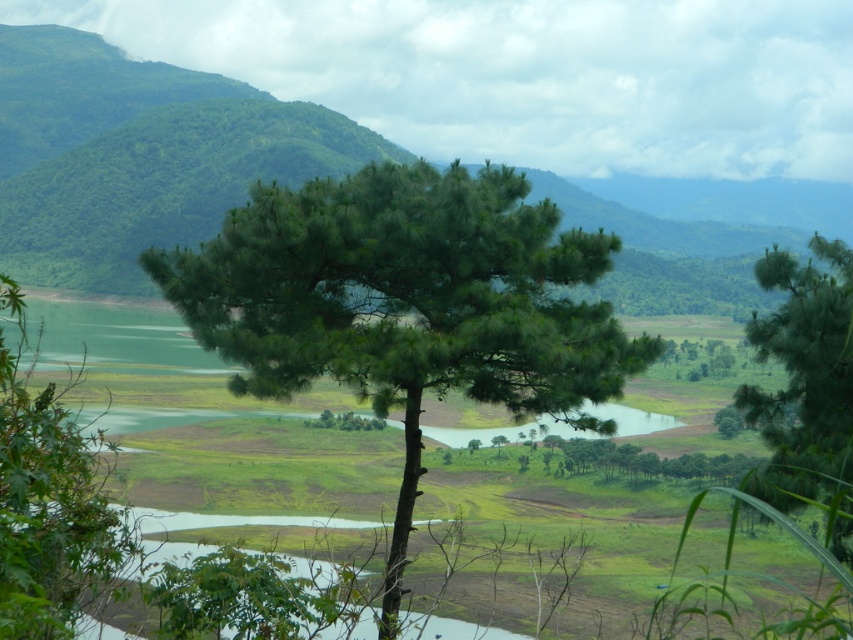
The image size is (853, 640). Describe the element at coordinates (405, 304) in the screenshot. I see `green matte tree at center` at that location.

Based on the photo, how distant is green matte tree at center from green matte tree at lower left?

They are 14.05 meters apart.

The height and width of the screenshot is (640, 853). In order to click on green matte tree at center in this screenshot , I will do `click(405, 304)`.

Image resolution: width=853 pixels, height=640 pixels. What do you see at coordinates (405, 304) in the screenshot? I see `green matte tree at center` at bounding box center [405, 304].

Where is `green matte tree at center`? This screenshot has height=640, width=853. green matte tree at center is located at coordinates (405, 304).

Between green matte tree at center and green leafy mountain at center, which one is positioned higher?

Positioned higher is green leafy mountain at center.

Between green matte tree at center and green leafy mountain at center, which one has more height?

green leafy mountain at center is taller.

Does point (215, 300) come in front of point (286, 122)?

Yes, point (215, 300) is in front of point (286, 122).

This screenshot has height=640, width=853. I want to click on green matte tree at center, so click(x=405, y=304).